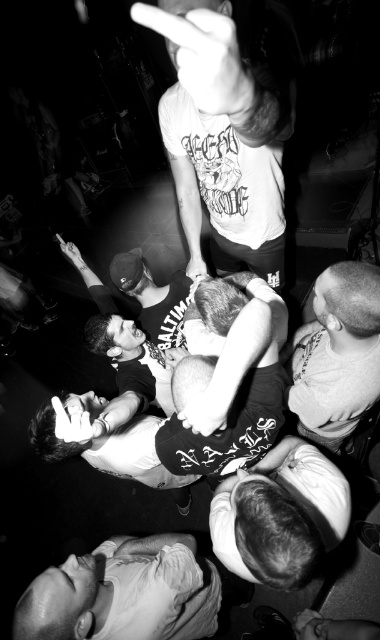
Who is taller, white t-shirt at upper center or smooth gray shirt at center?

With more height is smooth gray shirt at center.

Does point (196, 13) come farther from viewer compared to point (296, 344)?

No, it is not.

This screenshot has height=640, width=380. I want to click on white t-shirt at upper center, so click(223, 138).

Can you confirm if smooth white shirt at lower center is bigger than smooth gray shirt at center?

No, smooth white shirt at lower center is not bigger than smooth gray shirt at center.

Who is more forward, (x=261, y=474) or (x=346, y=275)?

Point (x=346, y=275) is more forward.

What do you see at coordinates (280, 515) in the screenshot?
I see `smooth white shirt at lower center` at bounding box center [280, 515].

I want to click on smooth white shirt at lower center, so click(x=280, y=515).

Consider the image. Between white t-shirt at upper center and smooth white shirt at lower left, which one is positioned higher?

white t-shirt at upper center is above.

Which is more to the right, white t-shirt at upper center or smooth white shirt at lower left?

From the viewer's perspective, white t-shirt at upper center appears more on the right side.

What do you see at coordinates (223, 138) in the screenshot?
I see `white t-shirt at upper center` at bounding box center [223, 138].

Find the location of a particular element. white t-shirt at upper center is located at coordinates pos(223,138).